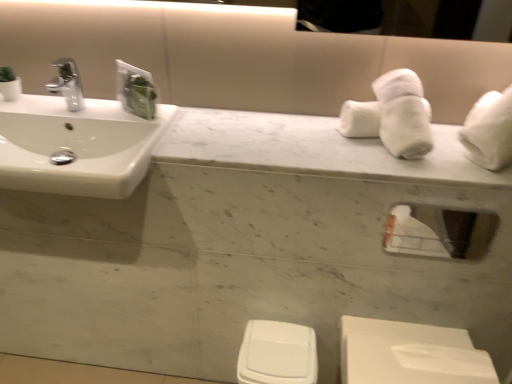
What are the coordinates of `free space above white plastic toilet bowl at lower center (from a real-world perspective)` in the screenshot? It's located at (280, 334).